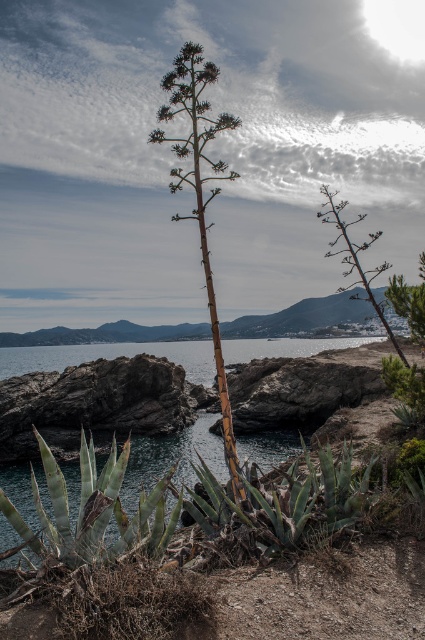
Question: Which point is farther from the camera taking this photo?

Choices:
 (A) (384, 317)
 (B) (25, 413)
 (C) (232, 477)

Answer: (B)

Question: Which point is closer to the camera?

Choices:
 (A) green spiky plant at center
 (B) dark gray rock at center
 (C) brown woody stem at center

Answer: (C)

Question: Is brown woody stem at center to the left of green spiky plant at center from the viewer's perspective?

Choices:
 (A) yes
 (B) no

Answer: (A)

Question: Is dark gray rock at center to the left of brown woody stem at center from the viewer's perspective?

Choices:
 (A) no
 (B) yes

Answer: (B)

Question: Is brown woody stem at center below green spiky plant at center?

Choices:
 (A) yes
 (B) no

Answer: (A)

Question: Considering the real-world distances, which object is farthest from the brown woody stem at center?

Choices:
 (A) green spiky plant at center
 (B) dark gray rock at center

Answer: (A)